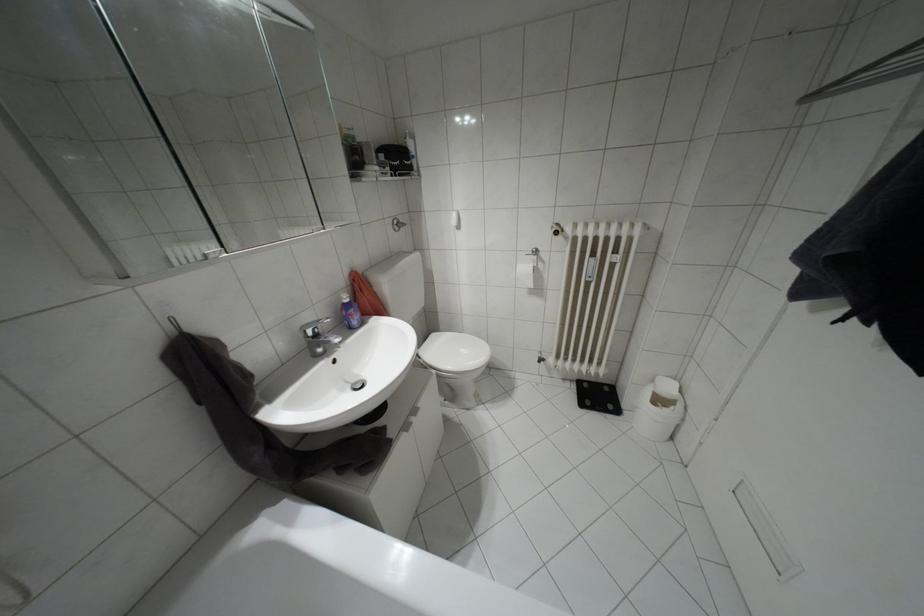
Find where to push the toilet flush button. Please return your answer as a coordinate pair (x, y).

(398, 225)